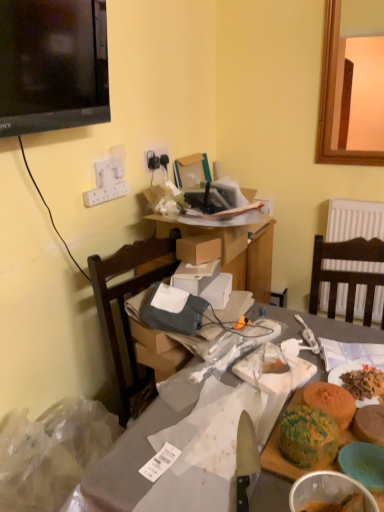
Question: Does shiny silver knife at center lie in front of green marbled cake at center, positioned as the 1th food in left-to-right order?

Choices:
 (A) no
 (B) yes

Answer: (B)

Question: Is green marbled cake at center, positioned as the 1th food in left-to-right order, surrounded by shiny silver knife at center?

Choices:
 (A) no
 (B) yes

Answer: (A)

Question: Can you confirm if shiny silver knife at center is positioned to the left of green marbled cake at center, the 3th food in the right-to-left sequence?

Choices:
 (A) yes
 (B) no

Answer: (A)

Question: Considering the relative sizes of shiny silver knife at center and green marbled cake at center, positioned as the 1th food in left-to-right order, in the image provided, is shiny silver knife at center smaller than green marbled cake at center, positioned as the 1th food in left-to-right order,?

Choices:
 (A) yes
 (B) no

Answer: (A)

Question: Is shiny silver knife at center bigger than green marbled cake at center, the 3th food in the right-to-left sequence?

Choices:
 (A) no
 (B) yes

Answer: (A)

Question: Considering the positions of transparent plastic bag at lower left and shiny silver knife at center in the image, is transparent plastic bag at lower left taller or shorter than shiny silver knife at center?

Choices:
 (A) short
 (B) tall

Answer: (B)

Question: Is transparent plastic bag at lower left to the left or to the right of shiny silver knife at center in the image?

Choices:
 (A) right
 (B) left

Answer: (B)

Question: Considering the positions of point (34, 421) and point (251, 432), is point (34, 421) closer or farther from the camera than point (251, 432)?

Choices:
 (A) farther
 (B) closer

Answer: (A)

Question: Considering the positions of transparent plastic bag at lower left and shiny silver knife at center in the image, is transparent plastic bag at lower left bigger or smaller than shiny silver knife at center?

Choices:
 (A) small
 (B) big

Answer: (B)

Question: Considering the positions of black glossy television at upper left and matte gray table at center, placed as the second table when sorted from top to bottom, in the image, is black glossy television at upper left bigger or smaller than matte gray table at center, placed as the second table when sorted from top to bottom,?

Choices:
 (A) big
 (B) small

Answer: (B)

Question: Do you think black glossy television at upper left is within matte gray table at center, placed as the second table when sorted from top to bottom, or outside of it?

Choices:
 (A) inside
 (B) outside

Answer: (B)

Question: From a real-world perspective, relative to matte gray table at center, placed as the second table when sorted from top to bottom, is black glossy television at upper left vertically above or below?

Choices:
 (A) above
 (B) below

Answer: (A)

Question: In the image, is black glossy television at upper left on the left side or the right side of matte gray table at center, placed as the second table when sorted from top to bottom?

Choices:
 (A) left
 (B) right

Answer: (A)

Question: Which is correct: brown cardboard box at center is inside shiny silver knife at center, or outside of it?

Choices:
 (A) outside
 (B) inside

Answer: (A)

Question: In terms of width, does brown cardboard box at center look wider or thinner when compared to shiny silver knife at center?

Choices:
 (A) wide
 (B) thin

Answer: (B)